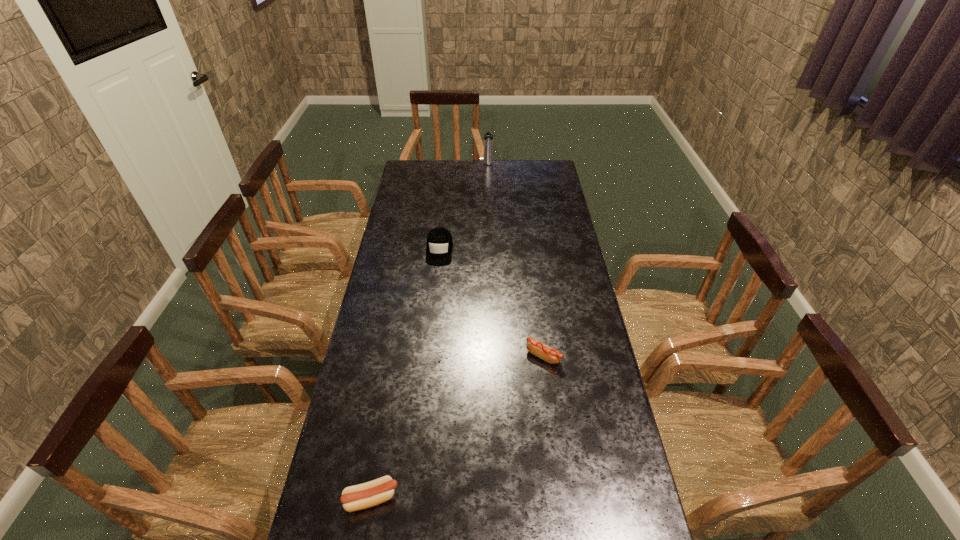
Identify the location of object that can be found as the second closest to the nearer sausage. Image resolution: width=960 pixels, height=540 pixels. (439, 247).

The width and height of the screenshot is (960, 540). Find the location of `object that is the second nearest to the tallest object`. object that is the second nearest to the tallest object is located at coordinates (549, 354).

At what (x,y) coordinates should I click in order to perform the action: click on vacant space that satisfies the following two spatial constraints: 1. on the back side of the nearest object; 2. on the left side of the farther sausage. Please return your answer as a coordinate pair (x, y). Image resolution: width=960 pixels, height=540 pixels. Looking at the image, I should click on (396, 356).

Where is `blank area in the image that satisfies the following two spatial constraints: 1. on the back side of the rightmost object; 2. on the left side of the left sausage`? The height and width of the screenshot is (540, 960). blank area in the image that satisfies the following two spatial constraints: 1. on the back side of the rightmost object; 2. on the left side of the left sausage is located at coordinates (396, 356).